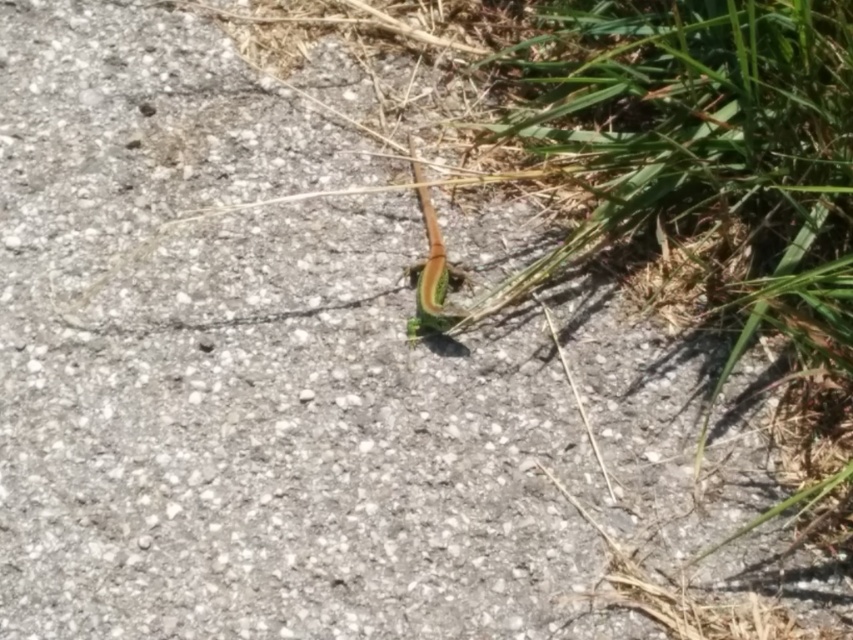
You are standing at the origin point in the scene. You see two points marked in the image. If you want to reach point point (523, 44) and point (439, 266), which point should you go to first if you want to reach the one that is closer to you?

Point point (439, 266) is closer to you than point point (523, 44), so you should go to point point (439, 266) first.

You are a photographer trying to capture the green leafy grass at center and the green matte grasshopper at center in the same frame. Based on their positions, which object is closer to the left side of the image?

The green matte grasshopper at center is closer to the left side because the green leafy grass at center is positioned to the right of it.

You are a photographer trying to capture a clear photo of the green leafy grass at center and the green matte grasshopper at center. Which object should you focus on first to ensure both are in focus?

The green leafy grass at center is in front of the green matte grasshopper at center, so you should focus on the green leafy grass at center first to ensure both are in focus.